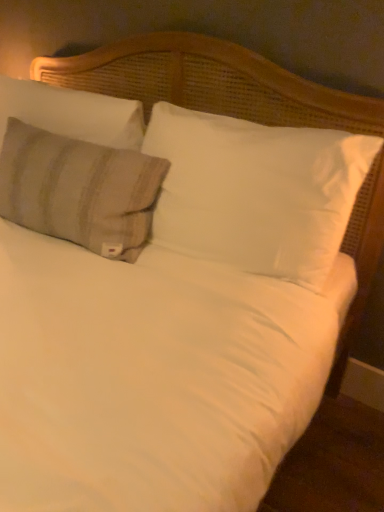
This screenshot has height=512, width=384. In order to click on white soft pillow at center, the third pillow when ordered from left to right in this screenshot , I will do `click(256, 191)`.

Describe the element at coordinates (256, 191) in the screenshot. This screenshot has height=512, width=384. I see `white soft pillow at center, which is the first pillow in right-to-left order` at that location.

Image resolution: width=384 pixels, height=512 pixels. I want to click on white soft pillow at center, the third pillow when ordered from left to right, so click(256, 191).

Choose the correct answer: Is beige striped fabric pillow at upper left, which is counted as the 2th pillow, starting from the right, inside white soft pillow at center, the third pillow when ordered from left to right, or outside it?

beige striped fabric pillow at upper left, which is counted as the 2th pillow, starting from the right, cannot be found inside white soft pillow at center, the third pillow when ordered from left to right.

Is beige striped fabric pillow at upper left, acting as the 2th pillow starting from the left, at the right side of white soft pillow at center, the third pillow when ordered from left to right?

Incorrect, beige striped fabric pillow at upper left, acting as the 2th pillow starting from the left, is not on the right side of white soft pillow at center, the third pillow when ordered from left to right.

Is point (131, 176) closer to viewer compared to point (335, 210)?

That is False.

From the image's perspective, between beige striped fabric pillow at upper left, which is counted as the 2th pillow, starting from the right, and white soft pillow at center, the third pillow when ordered from left to right, which one is located above?

beige striped fabric pillow at upper left, which is counted as the 2th pillow, starting from the right, is shown above in the image.

Which of these two, beige striped pillow at left, which is the 3th pillow in right-to-left order, or beige striped fabric pillow at upper left, which is counted as the 2th pillow, starting from the right, is thinner?

beige striped pillow at left, which is the 3th pillow in right-to-left order, is thinner.

Between beige striped pillow at left, which is the 3th pillow in right-to-left order, and beige striped fabric pillow at upper left, acting as the 2th pillow starting from the left, which one appears on the left side from the viewer's perspective?

beige striped pillow at left, which is the 3th pillow in right-to-left order.

Considering the positions of point (122, 99) and point (148, 182), is point (122, 99) closer or farther from the camera than point (148, 182)?

Point (122, 99) is positioned farther from the camera compared to point (148, 182).

Consider the image. Is beige striped pillow at left, which is the 3th pillow in right-to-left order, far from beige striped fabric pillow at upper left, acting as the 2th pillow starting from the left?

No, beige striped pillow at left, which is the 3th pillow in right-to-left order, is not far from beige striped fabric pillow at upper left, acting as the 2th pillow starting from the left.

Would you say beige striped fabric pillow at upper left, which is counted as the 2th pillow, starting from the right, is inside or outside beige striped pillow at left, which ranks as the 1th pillow in left-to-right order?

beige striped fabric pillow at upper left, which is counted as the 2th pillow, starting from the right, is spatially situated outside beige striped pillow at left, which ranks as the 1th pillow in left-to-right order.

Considering the relative sizes of beige striped fabric pillow at upper left, acting as the 2th pillow starting from the left, and beige striped pillow at left, which ranks as the 1th pillow in left-to-right order, in the image provided, is beige striped fabric pillow at upper left, acting as the 2th pillow starting from the left, thinner than beige striped pillow at left, which ranks as the 1th pillow in left-to-right order,?

In fact, beige striped fabric pillow at upper left, acting as the 2th pillow starting from the left, might be wider than beige striped pillow at left, which ranks as the 1th pillow in left-to-right order.

From the image's perspective, which object appears higher, beige striped fabric pillow at upper left, which is counted as the 2th pillow, starting from the right, or beige striped pillow at left, which ranks as the 1th pillow in left-to-right order?

beige striped pillow at left, which ranks as the 1th pillow in left-to-right order.

From their relative heights in the image, would you say beige striped fabric pillow at upper left, which is counted as the 2th pillow, starting from the right, is taller or shorter than beige striped pillow at left, which ranks as the 1th pillow in left-to-right order?

Considering their sizes, beige striped fabric pillow at upper left, which is counted as the 2th pillow, starting from the right, has more height than beige striped pillow at left, which ranks as the 1th pillow in left-to-right order.

Considering the sizes of objects white soft pillow at center, the third pillow when ordered from left to right, and beige striped fabric pillow at upper left, acting as the 2th pillow starting from the left, in the image provided, who is thinner, white soft pillow at center, the third pillow when ordered from left to right, or beige striped fabric pillow at upper left, acting as the 2th pillow starting from the left,?

beige striped fabric pillow at upper left, acting as the 2th pillow starting from the left.

Considering the positions of objects white soft pillow at center, which is the first pillow in right-to-left order, and beige striped fabric pillow at upper left, which is counted as the 2th pillow, starting from the right, in the image provided, who is more to the left, white soft pillow at center, which is the first pillow in right-to-left order, or beige striped fabric pillow at upper left, which is counted as the 2th pillow, starting from the right,?

beige striped fabric pillow at upper left, which is counted as the 2th pillow, starting from the right.

Where is `the 1st pillow behind the white soft pillow at center, the third pillow when ordered from left to right`? This screenshot has width=384, height=512. the 1st pillow behind the white soft pillow at center, the third pillow when ordered from left to right is located at coordinates (79, 190).

Which is nearer, (309, 267) or (34, 196)?

The point (309, 267) is closer to the camera.

Is beige striped pillow at left, which is the 3th pillow in right-to-left order, surrounded by white soft pillow at center, the third pillow when ordered from left to right?

No, beige striped pillow at left, which is the 3th pillow in right-to-left order, is located outside of white soft pillow at center, the third pillow when ordered from left to right.

Consider the image. Considering the sizes of objects white soft pillow at center, the third pillow when ordered from left to right, and beige striped pillow at left, which ranks as the 1th pillow in left-to-right order, in the image provided, who is taller, white soft pillow at center, the third pillow when ordered from left to right, or beige striped pillow at left, which ranks as the 1th pillow in left-to-right order,?

white soft pillow at center, the third pillow when ordered from left to right, is taller.

Looking at this image, are white soft pillow at center, the third pillow when ordered from left to right, and beige striped pillow at left, which is the 3th pillow in right-to-left order, far apart?

No, white soft pillow at center, the third pillow when ordered from left to right, is not far from beige striped pillow at left, which is the 3th pillow in right-to-left order.

Who is bigger, white soft pillow at center, the third pillow when ordered from left to right, or beige striped pillow at left, which is the 3th pillow in right-to-left order?

white soft pillow at center, the third pillow when ordered from left to right.

Can you see beige striped pillow at left, which ranks as the 1th pillow in left-to-right order, touching white soft pillow at center, which is the first pillow in right-to-left order?

No.

From a real-world perspective, which object stands above the other?

In real-world perspective, beige striped pillow at left, which ranks as the 1th pillow in left-to-right order, is above.

Which of these two, beige striped pillow at left, which ranks as the 1th pillow in left-to-right order, or white soft pillow at center, which is the first pillow in right-to-left order, is thinner?

beige striped pillow at left, which ranks as the 1th pillow in left-to-right order.

This screenshot has width=384, height=512. I want to click on pillow that is the 1st one when counting backward from the white soft pillow at center, which is the first pillow in right-to-left order, so pos(79,190).

Where is `pillow on the left side of beige striped fabric pillow at upper left, acting as the 2th pillow starting from the left`? pillow on the left side of beige striped fabric pillow at upper left, acting as the 2th pillow starting from the left is located at coordinates (72, 113).

Estimate the real-world distances between objects in this image. Which object is further from white soft pillow at center, which is the first pillow in right-to-left order, beige striped fabric pillow at upper left, which is counted as the 2th pillow, starting from the right, or beige striped pillow at left, which ranks as the 1th pillow in left-to-right order?

Based on the image, beige striped pillow at left, which ranks as the 1th pillow in left-to-right order, appears to be further to white soft pillow at center, which is the first pillow in right-to-left order.

Based on their spatial positions, is beige striped fabric pillow at upper left, which is counted as the 2th pillow, starting from the right, or white soft pillow at center, which is the first pillow in right-to-left order, closer to beige striped pillow at left, which is the 3th pillow in right-to-left order?

Based on the image, beige striped fabric pillow at upper left, which is counted as the 2th pillow, starting from the right, appears to be nearer to beige striped pillow at left, which is the 3th pillow in right-to-left order.

When comparing their distances from beige striped fabric pillow at upper left, acting as the 2th pillow starting from the left, does beige striped pillow at left, which is the 3th pillow in right-to-left order, or white soft pillow at center, the third pillow when ordered from left to right, seem further?

white soft pillow at center, the third pillow when ordered from left to right, lies further to beige striped fabric pillow at upper left, acting as the 2th pillow starting from the left, than the other object.

Looking at the image, which one is located further to beige striped pillow at left, which is the 3th pillow in right-to-left order, white soft pillow at center, the third pillow when ordered from left to right, or beige striped fabric pillow at upper left, which is counted as the 2th pillow, starting from the right?

white soft pillow at center, the third pillow when ordered from left to right.

Based on their spatial positions, is white soft pillow at center, which is the first pillow in right-to-left order, or beige striped pillow at left, which is the 3th pillow in right-to-left order, further from beige striped fabric pillow at upper left, acting as the 2th pillow starting from the left?

The object further to beige striped fabric pillow at upper left, acting as the 2th pillow starting from the left, is white soft pillow at center, which is the first pillow in right-to-left order.

Based on their spatial positions, is beige striped pillow at left, which is the 3th pillow in right-to-left order, or beige striped fabric pillow at upper left, acting as the 2th pillow starting from the left, closer to white soft pillow at center, the third pillow when ordered from left to right?

beige striped fabric pillow at upper left, acting as the 2th pillow starting from the left, is closer to white soft pillow at center, the third pillow when ordered from left to right.

The height and width of the screenshot is (512, 384). What are the coordinates of `pillow situated between beige striped pillow at left, which ranks as the 1th pillow in left-to-right order, and white soft pillow at center, the third pillow when ordered from left to right, from left to right` in the screenshot? It's located at (79, 190).